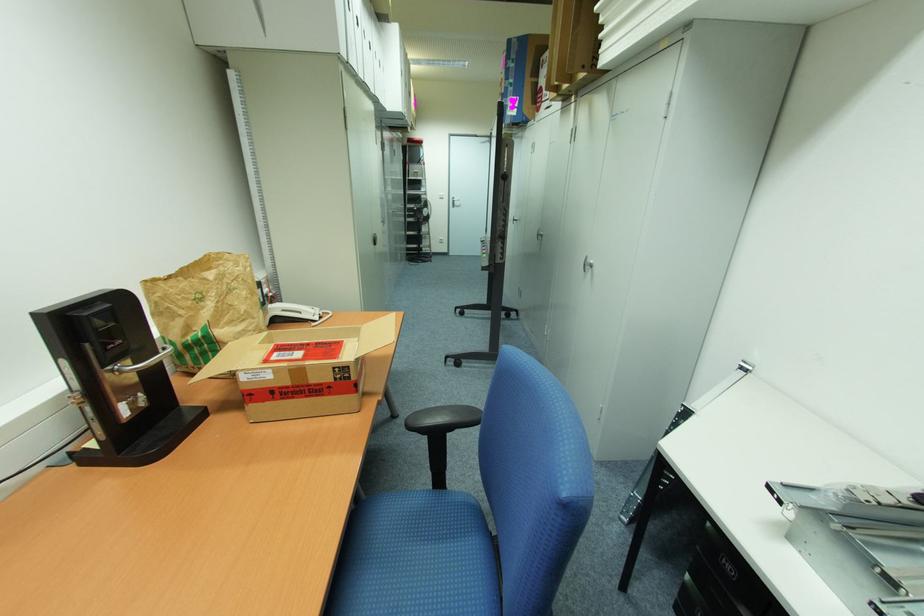
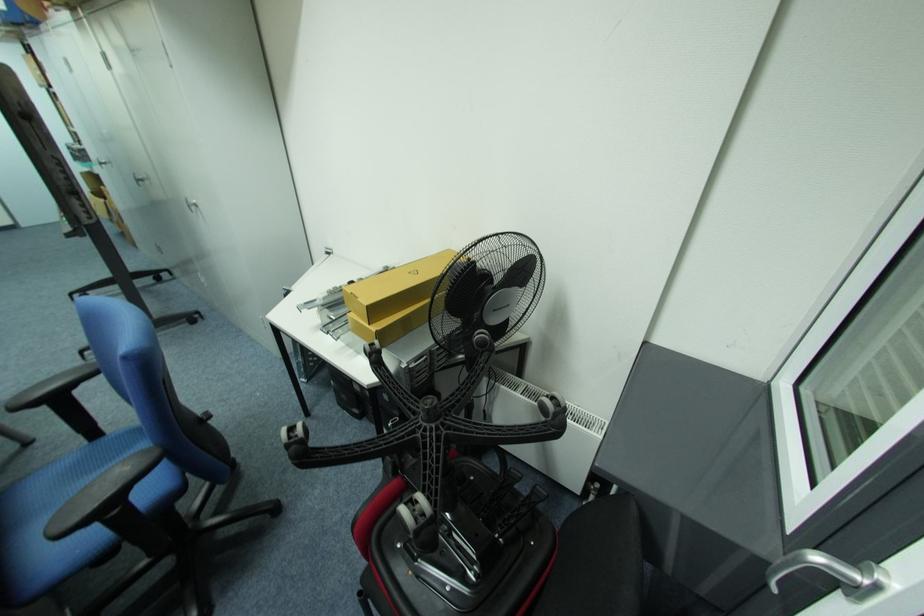
In the second image, find the point that corresponds to [591,262] in the first image.

(196, 203)